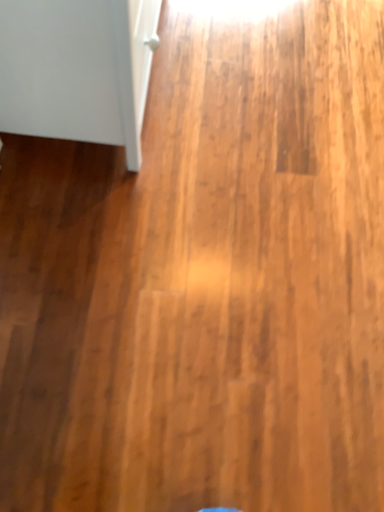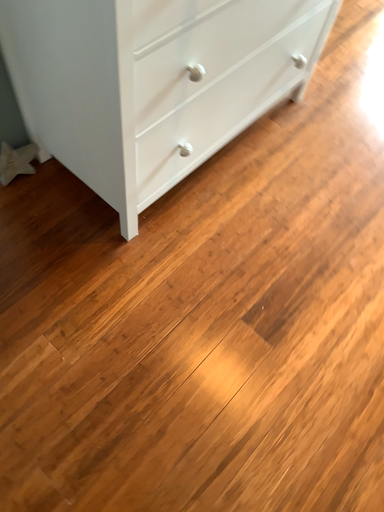
Question: How did the camera likely rotate when shooting the video?

Choices:
 (A) rotated right
 (B) rotated left

Answer: (B)